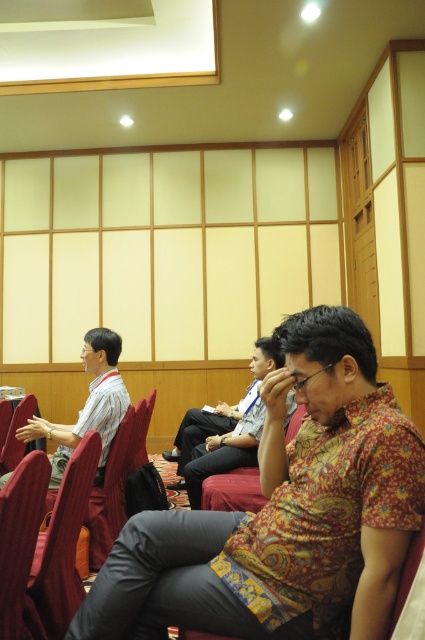
You are organizing a photo shoot and need to ensure that the batik shirt at center and the patterned fabric shirt at center are visible in the frame. Given their heights, which shirt should you position closer to the camera to ensure both are fully visible?

The batik shirt at center is shorter than the patterned fabric shirt at center, so positioning the batik shirt at center closer to the camera will help ensure both shirts are fully visible.